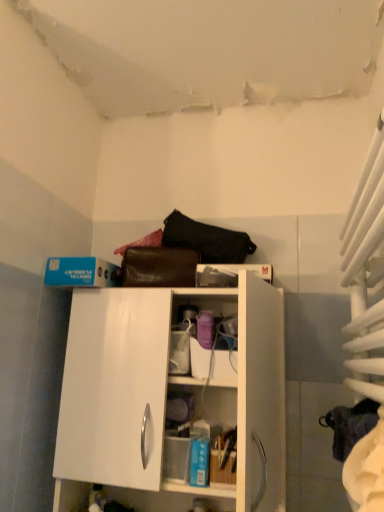
Find the location of a particular element. This screenshot has width=384, height=512. black leather handbag at upper center is located at coordinates (206, 240).

What is the approximate height of black leather handbag at upper center?

6.19 inches.

Find the location of a particular element. white fabric curtain at right is located at coordinates point(365,270).

From a real-world perspective, is black leather handbag at upper center physically located above or below white glossy cabinet at center?

In terms of real-world spatial position, black leather handbag at upper center is above white glossy cabinet at center.

Would you say black leather handbag at upper center is to the left or to the right of white glossy cabinet at center in the picture?

black leather handbag at upper center is positioned on white glossy cabinet at center's right side.

Is white fabric curtain at right completely or partially inside white glossy cabinet at center?

No, white fabric curtain at right is located outside of white glossy cabinet at center.

Are white glossy cabinet at center and white fabric curtain at right beside each other?

white glossy cabinet at center and white fabric curtain at right are clearly separated.

In the scene shown: How distant is white glossy cabinet at center from white fabric curtain at right?

The distance of white glossy cabinet at center from white fabric curtain at right is 15.10 inches.

From the image's perspective, between white glossy cabinet at center and white fabric curtain at right, which one is located above?

white fabric curtain at right is shown above in the image.

Measure the distance from black leather handbag at upper center to white fabric curtain at right.

17.34 inches.

Can you confirm if black leather handbag at upper center is bigger than white fabric curtain at right?

Incorrect, black leather handbag at upper center is not larger than white fabric curtain at right.

What's the angular difference between black leather handbag at upper center and white fabric curtain at right's facing directions?

88.5 degrees.

Is black leather handbag at upper center facing away from white fabric curtain at right?

No.

Find the location of `curtain below the black leather handbag at upper center (from the image's perspective)`. curtain below the black leather handbag at upper center (from the image's perspective) is located at coordinates (365, 270).

Is white fabric curtain at right wider or thinner than black leather handbag at upper center?

In the image, white fabric curtain at right appears to be wider than black leather handbag at upper center.

Does white fabric curtain at right have a greater height compared to black leather handbag at upper center?

Yes, white fabric curtain at right is taller than black leather handbag at upper center.

From a real-world perspective, is white fabric curtain at right physically above black leather handbag at upper center?

No, from a real-world perspective, white fabric curtain at right is not above black leather handbag at upper center.

Considering the relative positions of white glossy cabinet at center and black leather handbag at upper center in the image provided, is white glossy cabinet at center to the right of black leather handbag at upper center from the viewer's perspective?

No, white glossy cabinet at center is not to the right of black leather handbag at upper center.

Who is smaller, white glossy cabinet at center or black leather handbag at upper center?

With smaller size is black leather handbag at upper center.

Considering the relative sizes of white fabric curtain at right and white glossy cabinet at center in the image provided, is white fabric curtain at right smaller than white glossy cabinet at center?

Yes.

From the picture: From the image's perspective, is white fabric curtain at right beneath white glossy cabinet at center?

Actually, white fabric curtain at right appears above white glossy cabinet at center in the image.

Identify the location of curtain above the white glossy cabinet at center (from a real-world perspective). Image resolution: width=384 pixels, height=512 pixels. (365, 270).

Which point is more forward, (362, 180) or (107, 377)?

Point (362, 180)

You are a GUI agent. You are given a task and a screenshot of the screen. Output one action in this format:
    pyautogui.click(x=<x>, y=<y>)
    Task: Click on the cabinetry to the left of black leather handbag at upper center
    This screenshot has width=384, height=512.
    Given the screenshot: What is the action you would take?
    (x=167, y=397)

The width and height of the screenshot is (384, 512). Find the location of `curtain that is on the right side of white glossy cabinet at center`. curtain that is on the right side of white glossy cabinet at center is located at coordinates (365, 270).

From the image, which object appears to be nearer to black leather handbag at upper center, white fabric curtain at right or white glossy cabinet at center?

The object closer to black leather handbag at upper center is white glossy cabinet at center.

Estimate the real-world distances between objects in this image. Which object is closer to white glossy cabinet at center, black leather handbag at upper center or white fabric curtain at right?

The object closer to white glossy cabinet at center is black leather handbag at upper center.

Which object lies further to the anchor point black leather handbag at upper center, white glossy cabinet at center or white fabric curtain at right?

white fabric curtain at right is further to black leather handbag at upper center.

Looking at the image, which one is located closer to white glossy cabinet at center, white fabric curtain at right or black leather handbag at upper center?

Among the two, black leather handbag at upper center is located nearer to white glossy cabinet at center.

From the image, which object appears to be farther from white fabric curtain at right, white glossy cabinet at center or black leather handbag at upper center?

black leather handbag at upper center is further to white fabric curtain at right.

Consider the image. Considering their positions, is black leather handbag at upper center positioned closer to white fabric curtain at right than white glossy cabinet at center?

white glossy cabinet at center is closer to white fabric curtain at right.

Find the location of a particular element. Image resolution: width=384 pixels, height=512 pixels. cabinetry between white fabric curtain at right and black leather handbag at upper center from front to back is located at coordinates (167, 397).